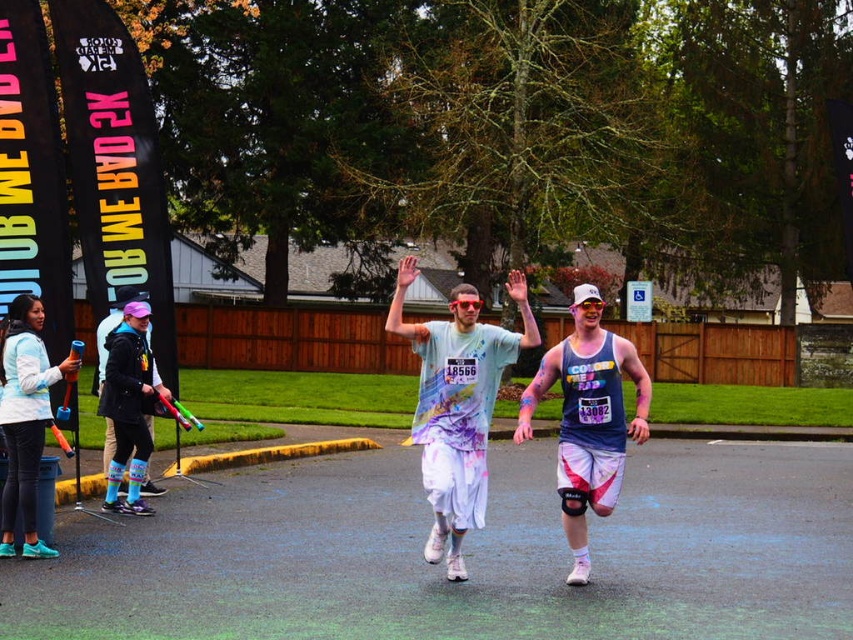
Question: Which point is farther to the camera?

Choices:
 (A) (395, 326)
 (B) (518, 432)
 (C) (21, 550)

Answer: (C)

Question: Which point is closer to the camera taking this photo?

Choices:
 (A) coord(35,353)
 (B) coord(584,340)

Answer: (B)

Question: Can you confirm if matte tie-dye shirt at center is positioned to the right of matte blue tank top at center?

Choices:
 (A) no
 (B) yes

Answer: (A)

Question: Based on their relative distances, which object is farther from the matte tie-dye shirt at center?

Choices:
 (A) matte blue tank top at center
 (B) matte blue jacket at lower left

Answer: (B)

Question: Can you confirm if matte blue tank top at center is positioned below matte blue jacket at lower left?

Choices:
 (A) yes
 (B) no

Answer: (B)

Question: Where is matte tie-dye shirt at center located in relation to matte blue jacket at lower left in the image?

Choices:
 (A) above
 (B) below

Answer: (B)